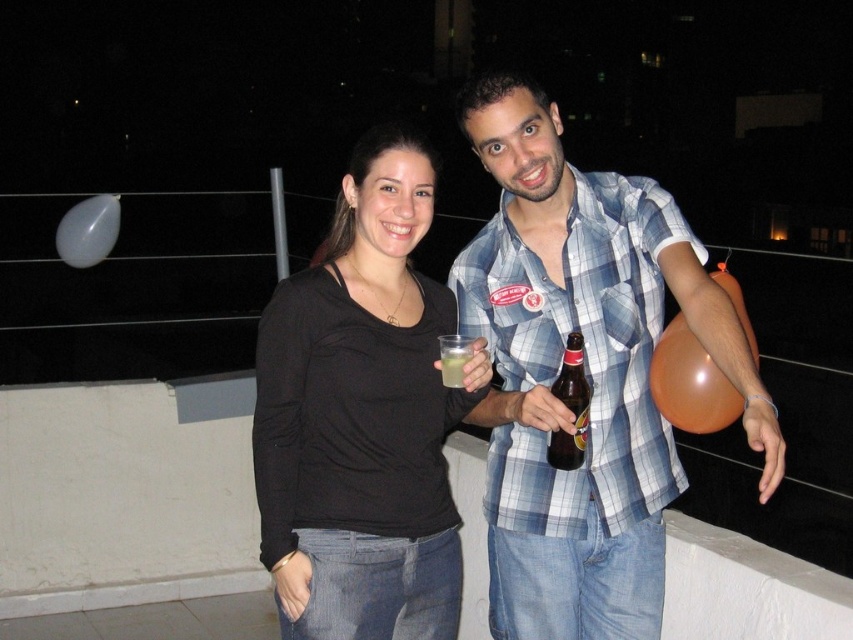
Is brown glass bottle at center positioned at the back of translucent plastic cup at center?

No.

Who is more distant from viewer, (567,397) or (445,385)?

Point (445,385)

Find the location of a particular element. brown glass bottle at center is located at coordinates (570, 406).

Between matte plastic beer bottle at center and translucent plastic cup at center, which one is positioned lower?

matte plastic beer bottle at center

Does matte plastic beer bottle at center appear on the right side of translucent plastic cup at center?

Indeed, matte plastic beer bottle at center is positioned on the right side of translucent plastic cup at center.

Which is behind, point (552, 419) or point (469, 346)?

The point (469, 346) is more distant.

Locate an element on the screen. Image resolution: width=853 pixels, height=640 pixels. matte plastic beer bottle at center is located at coordinates (538, 410).

Is orange rubber balloon at right bigger than transparent plastic balloon at upper left?

Incorrect, orange rubber balloon at right is not larger than transparent plastic balloon at upper left.

Between orange rubber balloon at right and transparent plastic balloon at upper left, which one is positioned higher?

transparent plastic balloon at upper left is above.

Describe the element at coordinates (689, 381) in the screenshot. The image size is (853, 640). I see `orange rubber balloon at right` at that location.

The image size is (853, 640). In order to click on orange rubber balloon at right in this screenshot , I will do `click(689, 381)`.